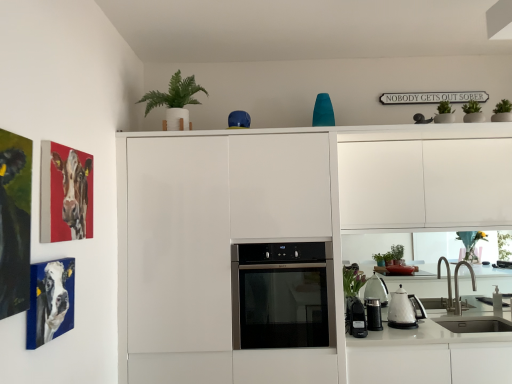
Question: Considering the relative sizes of silver metallic faucet at lower right and black plastic power strip at lower right, the 1th appliance when ordered from left to right, in the image provided, is silver metallic faucet at lower right smaller than black plastic power strip at lower right, the 1th appliance when ordered from left to right,?

Choices:
 (A) yes
 (B) no

Answer: (B)

Question: From the image's perspective, is silver metallic faucet at lower right beneath black plastic power strip at lower right, the 1th appliance when ordered from left to right?

Choices:
 (A) yes
 (B) no

Answer: (B)

Question: From a real-world perspective, is silver metallic faucet at lower right on top of black plastic power strip at lower right, the 1th appliance when ordered from left to right?

Choices:
 (A) yes
 (B) no

Answer: (A)

Question: Is the depth of silver metallic faucet at lower right greater than that of black plastic power strip at lower right, the 1th appliance when ordered from left to right?

Choices:
 (A) yes
 (B) no

Answer: (A)

Question: Is black plastic power strip at lower right, which is the 2th appliance from right to left, a part of silver metallic faucet at lower right?

Choices:
 (A) no
 (B) yes

Answer: (A)

Question: Does silver metallic faucet at lower right have a greater width compared to black plastic power strip at lower right, which is the 2th appliance from right to left?

Choices:
 (A) no
 (B) yes

Answer: (B)

Question: Is silver metallic faucet at lower right far away from satin black oven at center?

Choices:
 (A) no
 (B) yes

Answer: (B)

Question: From a real-world perspective, is silver metallic faucet at lower right physically below satin black oven at center?

Choices:
 (A) yes
 (B) no

Answer: (A)

Question: Is silver metallic faucet at lower right with satin black oven at center?

Choices:
 (A) yes
 (B) no

Answer: (B)

Question: Considering the relative sizes of silver metallic faucet at lower right and satin black oven at center in the image provided, is silver metallic faucet at lower right wider than satin black oven at center?

Choices:
 (A) yes
 (B) no

Answer: (B)

Question: Can you confirm if silver metallic faucet at lower right is positioned to the left of satin black oven at center?

Choices:
 (A) no
 (B) yes

Answer: (A)

Question: Considering the relative sizes of silver metallic faucet at lower right and satin black oven at center in the image provided, is silver metallic faucet at lower right shorter than satin black oven at center?

Choices:
 (A) yes
 (B) no

Answer: (A)

Question: Considering the relative sizes of black plastic power strip at lower right, which is the 2th appliance from right to left, and white glossy kettle at lower right in the image provided, is black plastic power strip at lower right, which is the 2th appliance from right to left, wider than white glossy kettle at lower right?

Choices:
 (A) yes
 (B) no

Answer: (A)